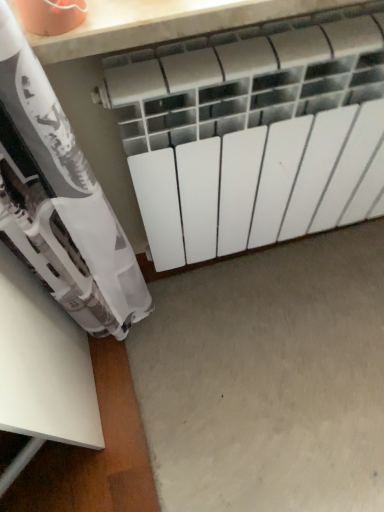
Identify the location of blank space above gray matte concrete at center (from a real-world perspective). The width and height of the screenshot is (384, 512). (280, 365).